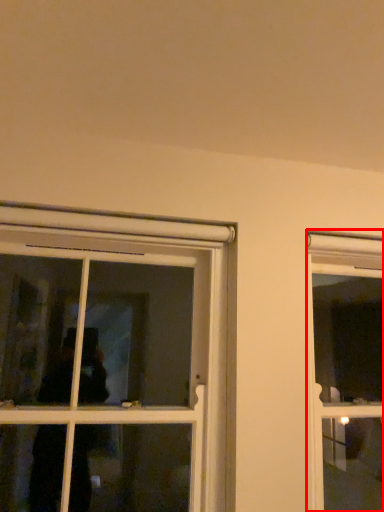
Question: Where is window (annotated by the red box) located in relation to window in the image?

Choices:
 (A) right
 (B) left

Answer: (A)